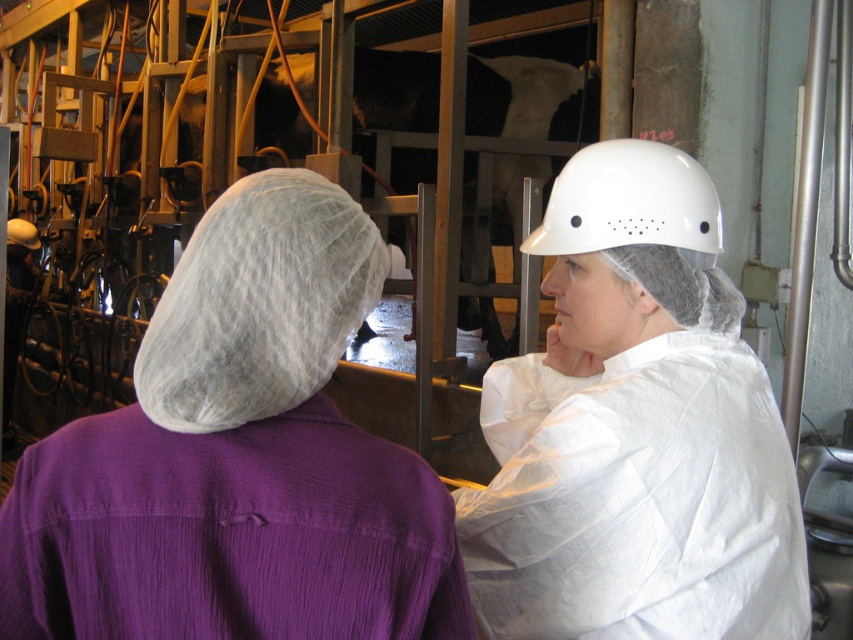
You are standing in a dairy farm facility and see a point at coordinates (238, 460). According to the image, what object is located at that point?

The point at (238, 460) corresponds to the purple fabric shirt at upper left.

You are standing in the dairy farm facility and need to locate the purple fabric shirt at upper left. According to the coordinates provided, where exactly is it positioned?

The purple fabric shirt at upper left is located at point (x=238, y=460).

You are a safety inspector in this dairy farm. You need to check the distance between the purple fabric shirt at upper left and the white matte helmet at upper center to ensure they are at least 2 inches apart for safety. Based on the image, is the current distance compliant with safety standards?

The purple fabric shirt at upper left and the white matte helmet at upper center are 1.93 inches apart, which is less than the required 2 inches for safety compliance. Therefore, the current distance does not meet the safety standards.